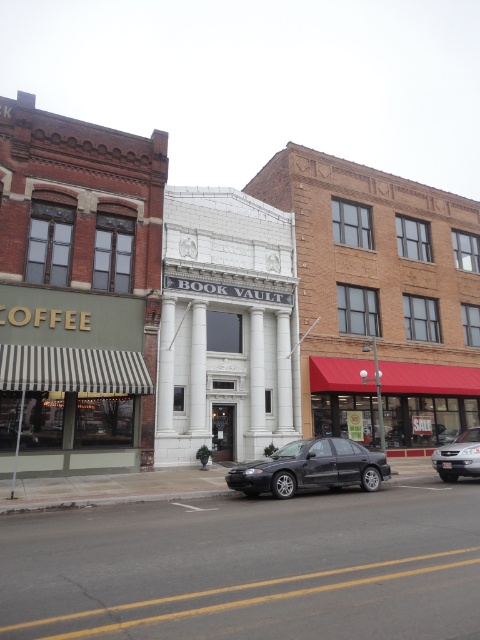
Does point (61, 189) lie in front of point (380, 452)?

No, it is behind (380, 452).

Is matte white building at center closer to the viewer compared to matte black sedan at center?

That is False.

I want to click on matte white building at center, so click(222, 304).

Where is `matte white building at center`? The height and width of the screenshot is (640, 480). matte white building at center is located at coordinates (222, 304).

Between point (255, 465) and point (468, 444), which one is positioned in front?

Point (255, 465) is more forward.

Is matte black sedan at center to the left of satin silver sedan at lower right from the viewer's perspective?

Correct, you'll find matte black sedan at center to the left of satin silver sedan at lower right.

Is point (360, 458) behind point (464, 474)?

No, it is not.

Where is `matte black sedan at center`? matte black sedan at center is located at coordinates (311, 468).

Which is above, matte white building at center or satin silver sedan at lower right?

Positioned higher is matte white building at center.

Consider the image. Does matte white building at center appear on the right side of satin silver sedan at lower right?

No, matte white building at center is not to the right of satin silver sedan at lower right.

Does point (35, 189) come farther from viewer compared to point (437, 467)?

Yes, it is behind point (437, 467).

The height and width of the screenshot is (640, 480). Find the location of `matte white building at center`. matte white building at center is located at coordinates (222, 304).